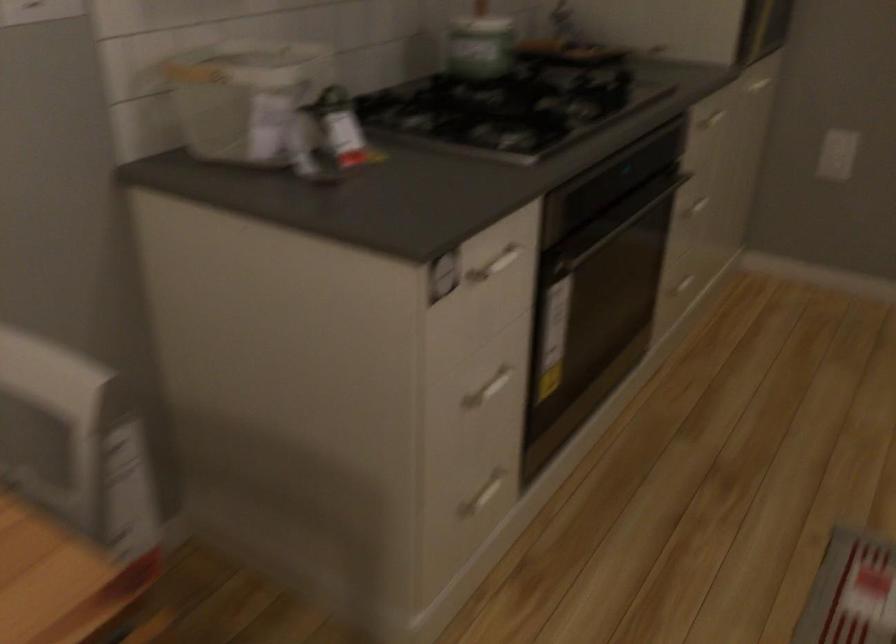
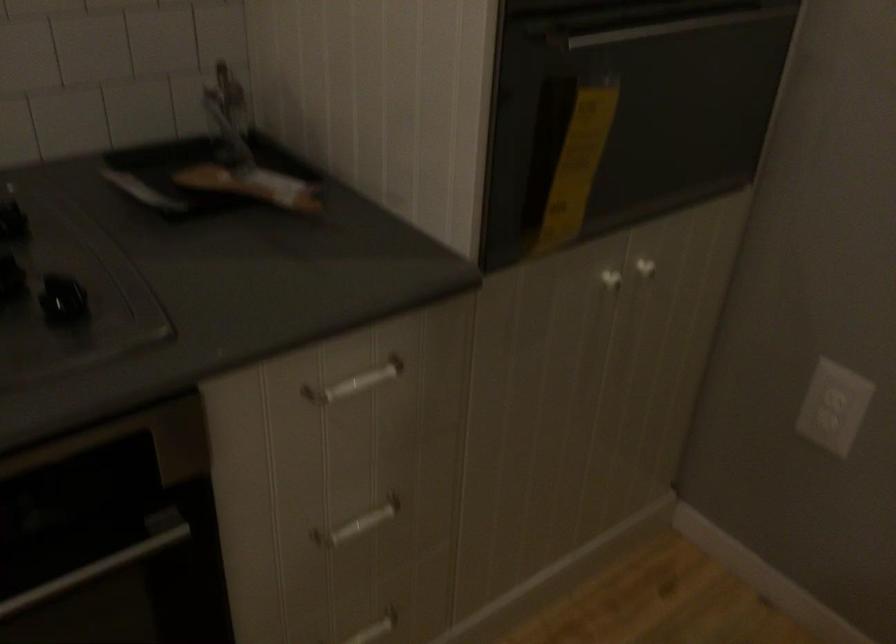
Where in the second image is the point corresponding to the point at 771,73 from the first image?

(645, 268)